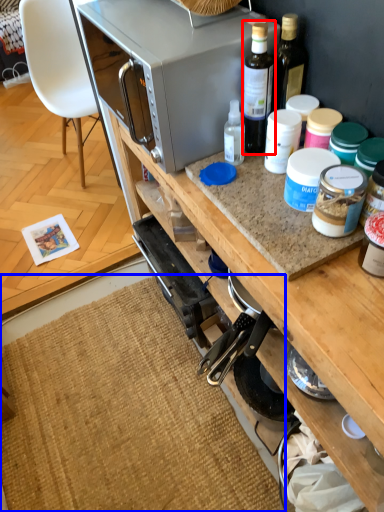
Question: Which object is further to the camera taking this photo, bottle (highlighted by a red box) or mat (highlighted by a blue box)?

Choices:
 (A) bottle
 (B) mat

Answer: (B)